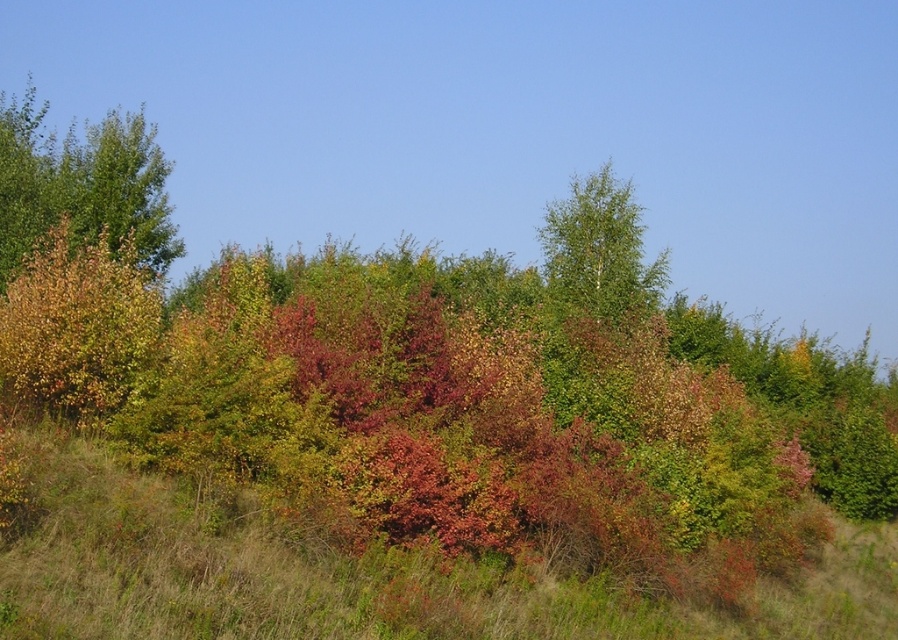
Which is behind, point (153, 636) or point (69, 195)?

The point (69, 195) is more distant.

Does green grass at center have a smaller size compared to green leafy tree at upper left?

Correct, green grass at center occupies less space than green leafy tree at upper left.

The image size is (898, 640). What do you see at coordinates (358, 577) in the screenshot? I see `green grass at center` at bounding box center [358, 577].

Where is `green grass at center`? The height and width of the screenshot is (640, 898). green grass at center is located at coordinates (358, 577).

Between green grass at center and green smooth tree at upper center, which one has more height?

green smooth tree at upper center is taller.

Can you confirm if green grass at center is positioned above green smooth tree at upper center?

No.

Is point (624, 637) farther from viewer compared to point (578, 205)?

No, it is not.

Where is `green grass at center`? This screenshot has height=640, width=898. green grass at center is located at coordinates (358, 577).

Does green leafy tree at upper left have a lesser width compared to green smooth tree at upper center?

In fact, green leafy tree at upper left might be wider than green smooth tree at upper center.

Can you confirm if green leafy tree at upper left is taller than green smooth tree at upper center?

Indeed, green leafy tree at upper left has a greater height compared to green smooth tree at upper center.

The height and width of the screenshot is (640, 898). What do you see at coordinates (82, 184) in the screenshot?
I see `green leafy tree at upper left` at bounding box center [82, 184].

Locate an element on the screen. Image resolution: width=898 pixels, height=640 pixels. green leafy tree at upper left is located at coordinates (82, 184).